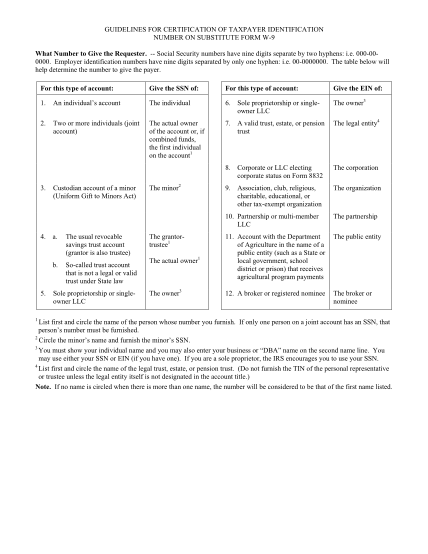
You are a GUI agent. You are given a task and a screenshot of the screen. Output one action in this format:
    pyautogui.click(x=<x>, y=<y>)
    Task: Click on the column
    This screenshot has height=554, width=428.
    Given the screenshot: What is the action you would take?
    pyautogui.click(x=189, y=175)